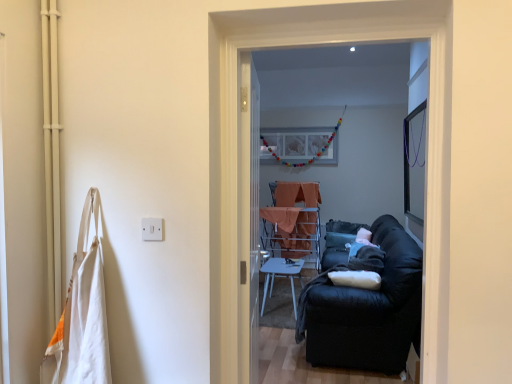
The image size is (512, 384). I want to click on white cotton bag at left, so click(82, 313).

This screenshot has width=512, height=384. Describe the element at coordinates (308, 160) in the screenshot. I see `matte white picture frame at center` at that location.

The width and height of the screenshot is (512, 384). I want to click on white cotton bag at left, so click(82, 313).

Does clear glass screen door at center, acting as the second screen door starting from the front, lie in front of orange fabric-covered table at center?

Yes, clear glass screen door at center, acting as the second screen door starting from the front, is closer to the viewer.

Between clear glass screen door at center, acting as the second screen door starting from the front, and orange fabric-covered table at center, which one has larger size?

With larger size is orange fabric-covered table at center.

Looking at this image, measure the distance from clear glass screen door at center, the first screen door from the back, to orange fabric-covered table at center.

clear glass screen door at center, the first screen door from the back, is 2.88 meters away from orange fabric-covered table at center.

Considering the points (257, 91) and (289, 239), which point is in front, point (257, 91) or point (289, 239)?

The point (257, 91) is in front.

Considering the points (293, 299) and (268, 145), which point is in front, point (293, 299) or point (268, 145)?

The point (293, 299) is closer to the camera.

Measure the distance between white glossy table at center and matte white picture frame at center.

white glossy table at center is 1.89 meters away from matte white picture frame at center.

From a real-world perspective, between white glossy table at center and matte white picture frame at center, who is vertically higher?

matte white picture frame at center.

Considering the relative sizes of white glossy table at center and matte white picture frame at center in the image provided, is white glossy table at center taller than matte white picture frame at center?

Incorrect, the height of white glossy table at center is not larger of that of matte white picture frame at center.

Would you say matte white picture frame at center is part of black fabric couch at right's contents?

No, matte white picture frame at center is not surrounded by black fabric couch at right.

Considering the sizes of black fabric couch at right and matte white picture frame at center in the image, is black fabric couch at right wider or thinner than matte white picture frame at center?

In the image, black fabric couch at right appears to be wider than matte white picture frame at center.

Image resolution: width=512 pixels, height=384 pixels. In the image, there is a matte white picture frame at center. Identify the location of studio couch below it (from a real-world perspective). (367, 310).

Is black fabric couch at right positioned with its back to matte white picture frame at center?

No, matte white picture frame at center is not at the back of black fabric couch at right.

Is point (264, 211) more distant than point (396, 84)?

That is False.

From a real-world perspective, relative to black fabric screen door at center, acting as the first screen door starting from the front, is orange fabric-covered table at center vertically above or below?

orange fabric-covered table at center is below black fabric screen door at center, acting as the first screen door starting from the front.

Between orange fabric-covered table at center and black fabric screen door at center, acting as the first screen door starting from the front, which one has more height?

black fabric screen door at center, acting as the first screen door starting from the front.

Is orange fabric-covered table at center turned away from black fabric screen door at center, acting as the second screen door starting from the back?

No.

Would you say white glossy table at center is outside clear glass screen door at center, acting as the second screen door starting from the front?

That's correct, white glossy table at center is outside of clear glass screen door at center, acting as the second screen door starting from the front.

From a real-world perspective, which object stands above the other?

In real-world perspective, clear glass screen door at center, the first screen door from the back, is above.

Find the location of a particular element. The image size is (512, 384). furniture located below the clear glass screen door at center, acting as the second screen door starting from the front (from the image's perspective) is located at coordinates (281, 277).

How distant is white glossy table at center from black fabric couch at right?

They are 1.17 meters apart.

Considering the sizes of objects white glossy table at center and black fabric couch at right in the image provided, who is wider, white glossy table at center or black fabric couch at right?

With larger width is black fabric couch at right.

Could you tell me if white glossy table at center is turned towards black fabric couch at right?

No, white glossy table at center is not facing towards black fabric couch at right.

Is white glossy table at center not near black fabric couch at right?

Yes.

Are white glossy table at center and white cotton bag at left located far from each other?

Yes, white glossy table at center is far from white cotton bag at left.

Which is behind, point (263, 271) or point (80, 246)?

The point (263, 271) is behind.

Considering the sizes of objects white glossy table at center and white cotton bag at left in the image provided, who is shorter, white glossy table at center or white cotton bag at left?

Standing shorter between the two is white glossy table at center.

Where is `the 1st screen door in front of the orange fabric-covered table at center`? The height and width of the screenshot is (384, 512). the 1st screen door in front of the orange fabric-covered table at center is located at coordinates click(x=249, y=220).

Find the location of a particular element. This screenshot has height=384, width=512. furniture that appears below the matte white picture frame at center (from a real-world perspective) is located at coordinates (281, 277).

When comparing their distances from white cotton bag at left, does orange fabric-covered table at center or black fabric couch at right seem closer?

The object closer to white cotton bag at left is black fabric couch at right.

Considering their positions, is white glossy table at center positioned closer to white cotton bag at left than black fabric screen door at center, acting as the second screen door starting from the back?

white glossy table at center is closer to white cotton bag at left.

Looking at the image, which one is located further to clear glass screen door at center, acting as the second screen door starting from the front, orange fabric-covered table at center or matte white picture frame at center?

The object further to clear glass screen door at center, acting as the second screen door starting from the front, is matte white picture frame at center.

Which object lies nearer to the anchor point black fabric screen door at center, acting as the second screen door starting from the back, matte white picture frame at center or white glossy table at center?

Among the two, matte white picture frame at center is located nearer to black fabric screen door at center, acting as the second screen door starting from the back.

Estimate the real-world distances between objects in this image. Which object is closer to orange fabric-covered table at center, matte white picture frame at center or black fabric screen door at center, acting as the second screen door starting from the back?

Based on the image, black fabric screen door at center, acting as the second screen door starting from the back, appears to be nearer to orange fabric-covered table at center.

Based on their spatial positions, is white glossy table at center or white cotton bag at left closer to black fabric couch at right?

Answer: The object closer to black fabric couch at right is white glossy table at center.

From the picture: When comparing their distances from orange fabric-covered table at center, does black fabric screen door at center, acting as the second screen door starting from the back, or white glossy table at center seem further?

black fabric screen door at center, acting as the second screen door starting from the back.

Which object lies further to the anchor point white glossy table at center, clear glass screen door at center, acting as the second screen door starting from the front, or orange fabric-covered table at center?

clear glass screen door at center, acting as the second screen door starting from the front.

What are the coordinates of `furniture located between clear glass screen door at center, acting as the second screen door starting from the front, and matte white picture frame at center in the depth direction` in the screenshot? It's located at (281, 277).

At what (x,y) coordinates should I click in order to perform the action: click on table between black fabric couch at right and matte white picture frame at center from front to back. Please return your answer as a coordinate pair (x, y). The width and height of the screenshot is (512, 384). Looking at the image, I should click on (291, 232).

At what (x,y) coordinates should I click in order to perform the action: click on studio couch located between clear glass screen door at center, acting as the second screen door starting from the front, and white glossy table at center in the depth direction. Please return your answer as a coordinate pair (x, y). The width and height of the screenshot is (512, 384). Looking at the image, I should click on [367, 310].

Identify the location of studio couch between black fabric screen door at center, acting as the second screen door starting from the back, and white glossy table at center from front to back. This screenshot has height=384, width=512. (367, 310).